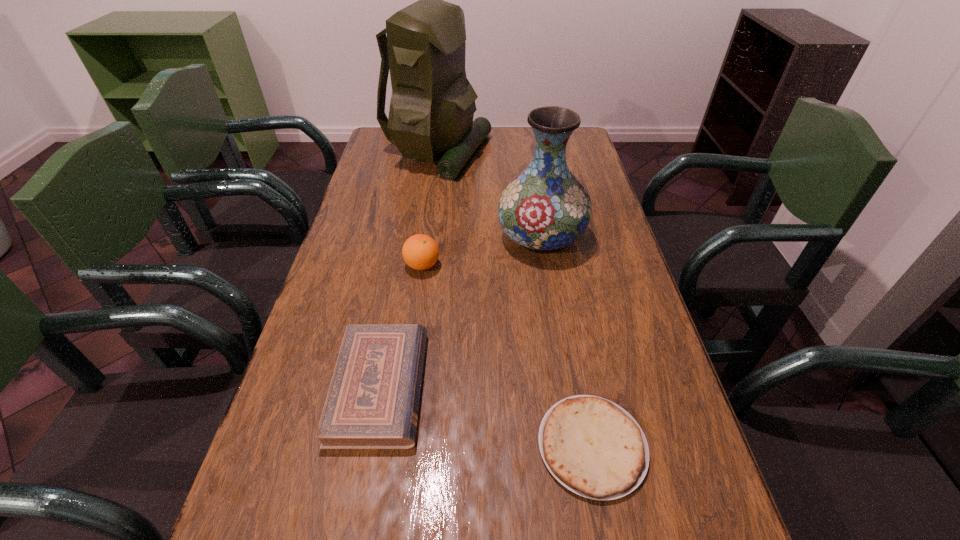
Find the location of a particular element. Image resolution: width=960 pixels, height=540 pixels. free space at the far right corner of the desktop is located at coordinates (588, 145).

Locate an element on the screen. The height and width of the screenshot is (540, 960). empty space between the fourth tallest object and the backpack is located at coordinates (408, 269).

I want to click on unoccupied area between the orange and the vase, so click(482, 251).

Find the location of a particular element. This screenshot has width=960, height=540. free space between the Bible and the tortilla is located at coordinates (486, 416).

Where is `free area in between the third shortest object and the vase`? The image size is (960, 540). free area in between the third shortest object and the vase is located at coordinates (482, 251).

You are a GUI agent. You are given a task and a screenshot of the screen. Output one action in this format:
    pyautogui.click(x=<x>, y=<y>)
    Task: Click on the free space between the third tallest object and the second tallest object
    Image resolution: width=960 pixels, height=540 pixels.
    Given the screenshot: What is the action you would take?
    pyautogui.click(x=482, y=251)

This screenshot has width=960, height=540. Identify the location of unoccupied area between the shortest object and the fourth tallest object. (486, 416).

You are a GUI agent. You are given a task and a screenshot of the screen. Output one action in this format:
    pyautogui.click(x=<x>, y=<y>)
    Task: Click on the free space between the Bible and the second tallest object
    This screenshot has width=960, height=540.
    Given the screenshot: What is the action you would take?
    pyautogui.click(x=461, y=312)

What are the coordinates of `free space between the Bible and the fourth shortest object` in the screenshot? It's located at (461, 312).

Locate an element on the screen. This screenshot has width=960, height=540. object identified as the third closest to the orange is located at coordinates point(432,106).